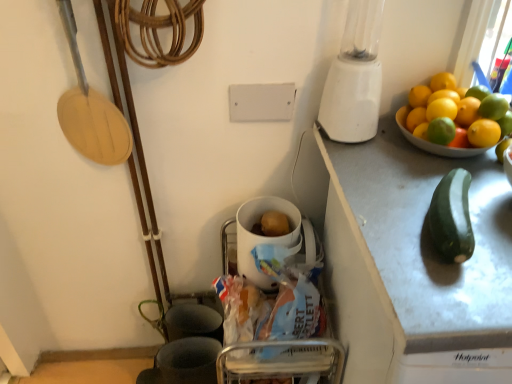
The width and height of the screenshot is (512, 384). In order to click on space that is in front of green matte lemon at upper right, which appears as the 1th lemon when ordered from the bottom in this screenshot , I will do `click(430, 202)`.